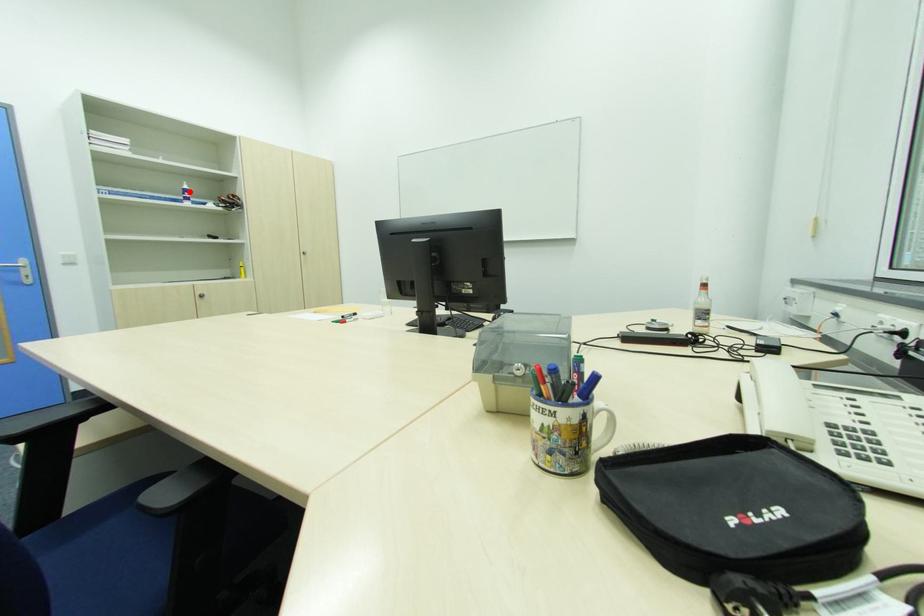
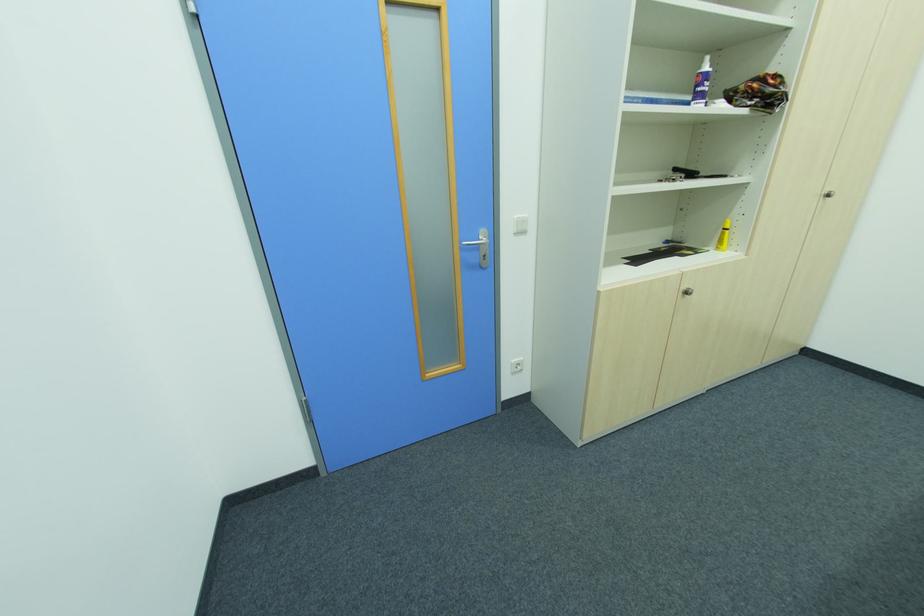
Locate, in the second image, the point that corresponds to the highlighted location in the first image.

(708, 78)